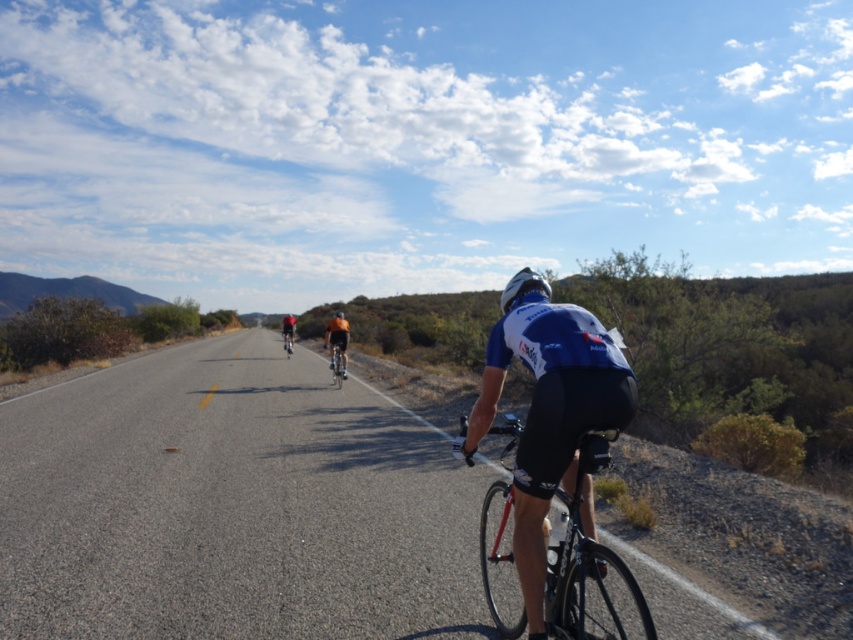
Based on the photo, is shiny black frame at center above shiny silver bicycle at center?

Incorrect, shiny black frame at center is not positioned above shiny silver bicycle at center.

Which is below, shiny black frame at center or shiny silver bicycle at center?

shiny black frame at center is below.

Does point (547, 624) lie in front of point (329, 368)?

Yes, it is in front of point (329, 368).

Find the location of a particular element. This screenshot has width=853, height=640. shiny black frame at center is located at coordinates (585, 557).

Is white matte bicycle helmet at center shorter than orange fabric cyclist at center?

Yes.

Which of these two, white matte bicycle helmet at center or orange fabric cyclist at center, stands shorter?

white matte bicycle helmet at center

The image size is (853, 640). Find the location of `white matte bicycle helmet at center`. white matte bicycle helmet at center is located at coordinates (521, 288).

The height and width of the screenshot is (640, 853). In order to click on white matte bicycle helmet at center in this screenshot , I will do `click(521, 288)`.

Identify the location of white matte bicycle helmet at center. (521, 288).

Looking at this image, between white matte bicycle helmet at center and shiny silver bicycle at center, which one has less height?

white matte bicycle helmet at center

What do you see at coordinates (521, 288) in the screenshot? The width and height of the screenshot is (853, 640). I see `white matte bicycle helmet at center` at bounding box center [521, 288].

At what (x,y) coordinates should I click in order to perform the action: click on white matte bicycle helmet at center. Please return your answer as a coordinate pair (x, y). Looking at the image, I should click on (521, 288).